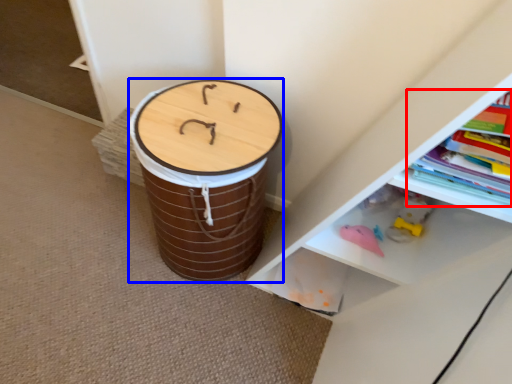
Question: Which object is further to the camera taking this photo, book (highlighted by a red box) or drum (highlighted by a blue box)?

Choices:
 (A) book
 (B) drum

Answer: (B)